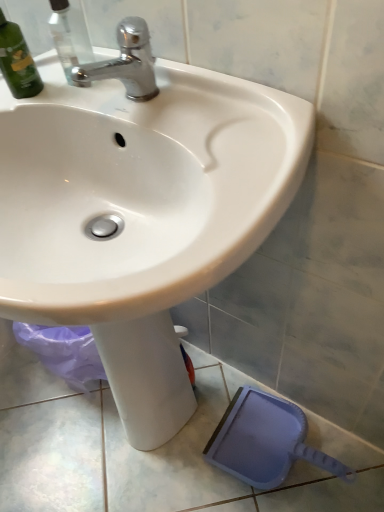
Where is `vacant area that is in front of green matte bottle at upper left`? The image size is (384, 512). vacant area that is in front of green matte bottle at upper left is located at coordinates (59, 105).